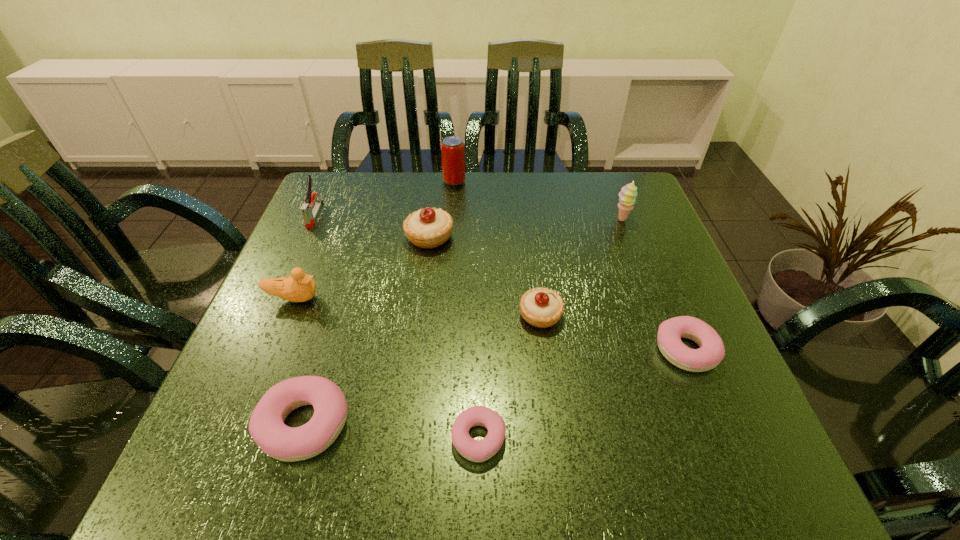
Where is `free space between the sherbert and the right beige pastry`? free space between the sherbert and the right beige pastry is located at coordinates (581, 267).

Image resolution: width=960 pixels, height=540 pixels. I want to click on vacant area between the second pastry from left to right and the sherbert, so click(x=525, y=228).

Point out which object is positioned as the fifth nearest to the duckling. Please provide its 2D coordinates. Your answer should be formatted as a tuple, i.e. [(x, y)], where the tuple contains the x and y coordinates of a point satisfying the conditions above.

[(541, 307)]

Locate an element on the screen. object identified as the fifth closest to the bigger beige pastry is located at coordinates (266, 426).

Locate an element on the screen. This screenshot has height=540, width=960. pastry identified as the closest to the sherbert is located at coordinates pyautogui.click(x=541, y=307).

Locate which pastry ranks second in proximity to the bigger beige pastry. Please provide its 2D coordinates. Your answer should be formatted as a tuple, i.e. [(x, y)], where the tuple contains the x and y coordinates of a point satisfying the conditions above.

[(266, 426)]

Choose which pink pastry is the second nearest neighbor to the second shortest object. Please provide its 2D coordinates. Your answer should be formatted as a tuple, i.e. [(x, y)], where the tuple contains the x and y coordinates of a point satisfying the conditions above.

[(266, 426)]

Find the location of `the second closest pink pastry to the farthest pink pastry`. the second closest pink pastry to the farthest pink pastry is located at coordinates (266, 426).

Identify the location of vacant position in the image that satisfies the following two spatial constraints: 1. on the face of the duckling; 2. on the back side of the farthest pink pastry. This screenshot has height=540, width=960. (272, 350).

Locate an element on the screen. This screenshot has height=540, width=960. free space that satisfies the following two spatial constraints: 1. on the back side of the third pastry from right to left; 2. on the left side of the right beige pastry is located at coordinates (479, 315).